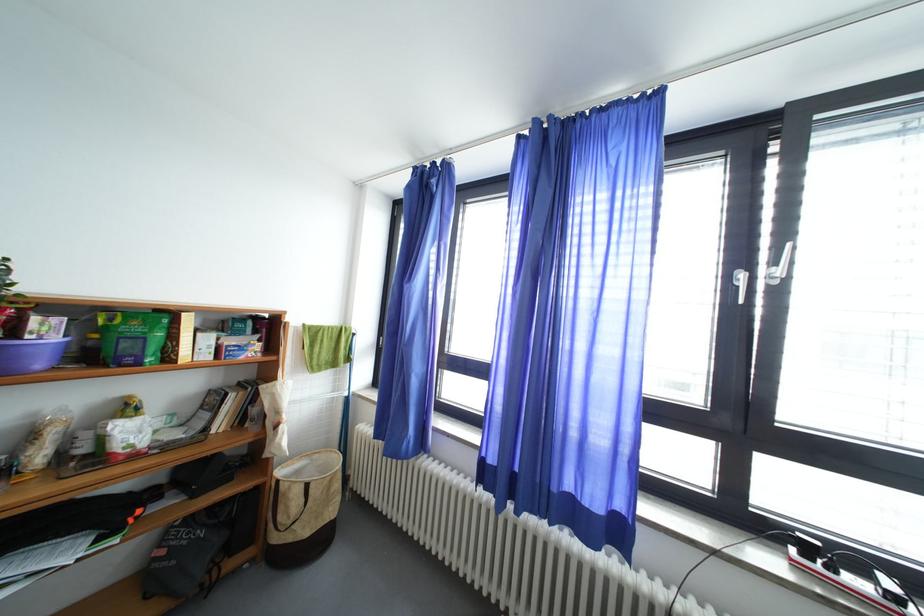
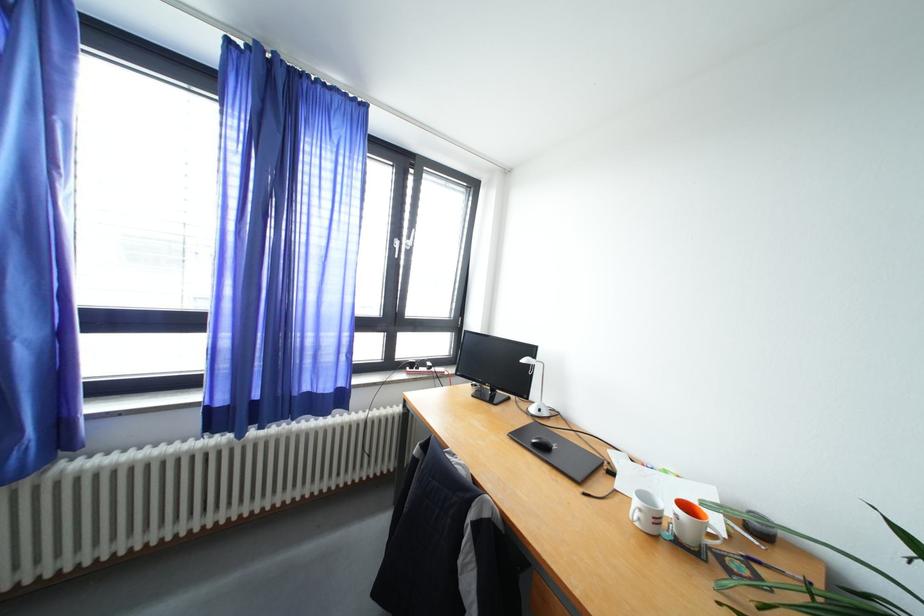
The point at (748, 280) is marked in the first image. Where is the corresponding point in the second image?

(404, 246)